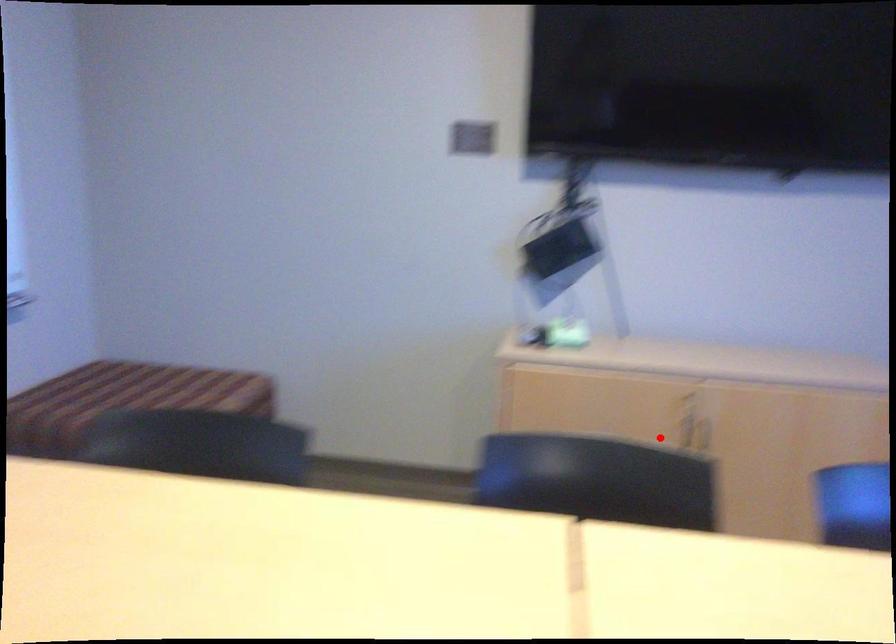
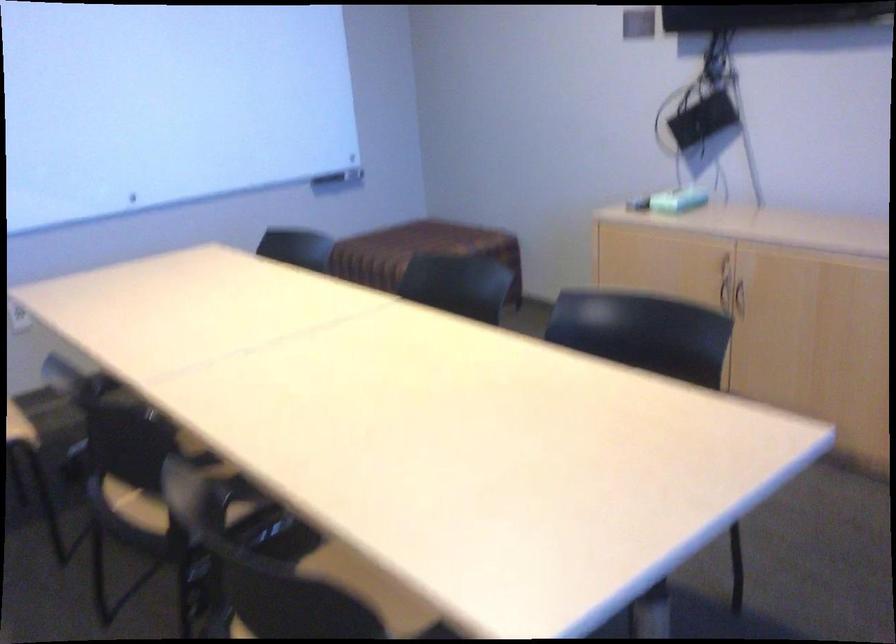
Locate, in the second image, the point that corresponds to the highlighted location in the first image.

(725, 295)